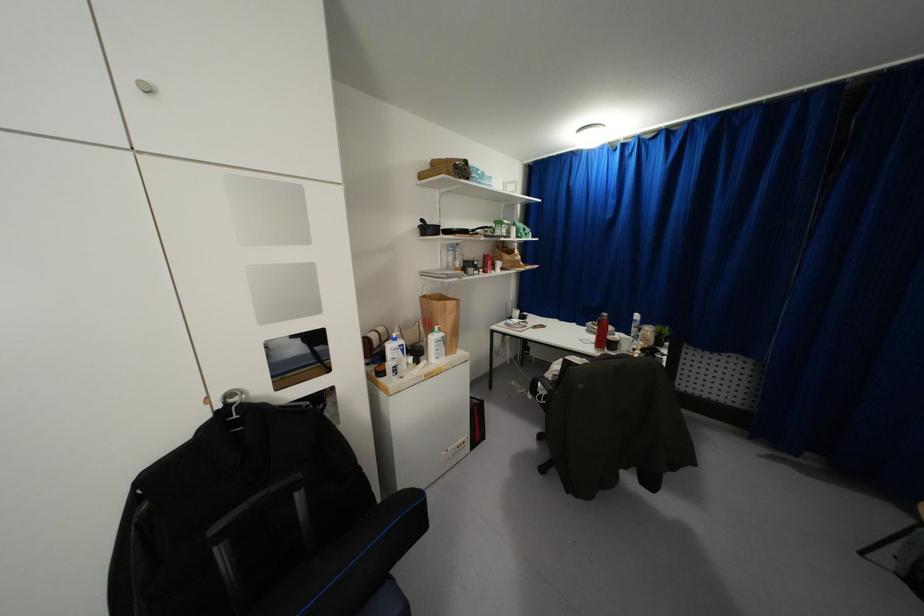
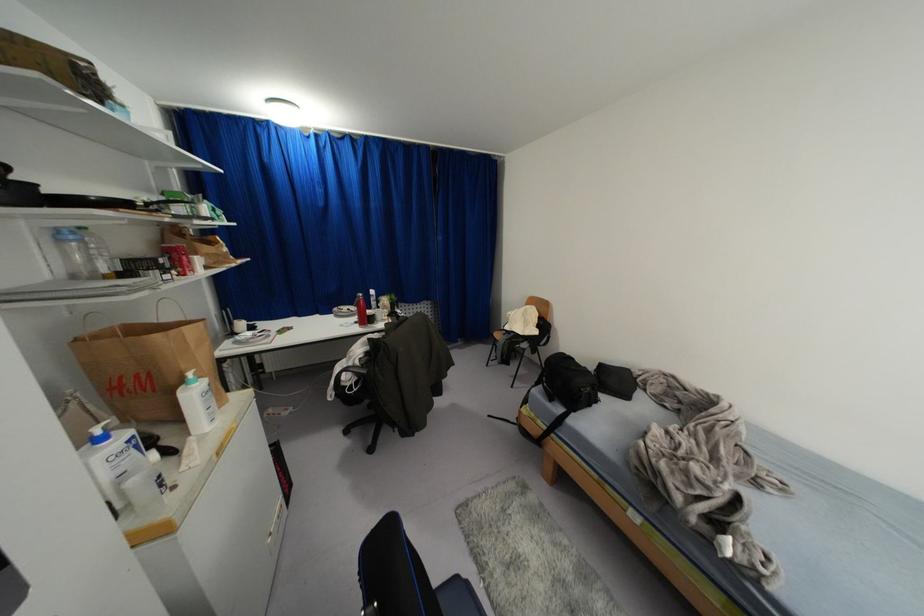
Locate, in the second image, the point that corresponds to point (435, 326) in the first image.

(189, 374)